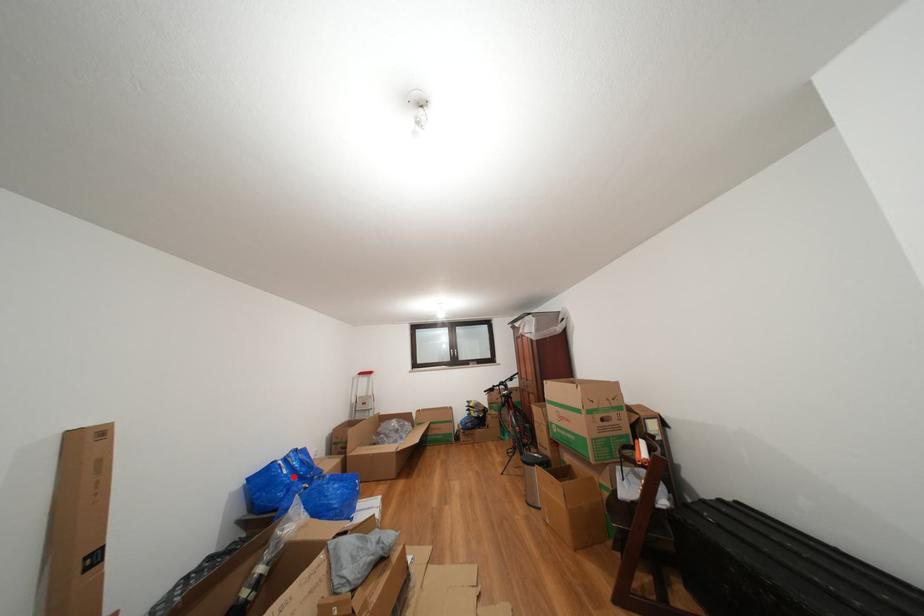
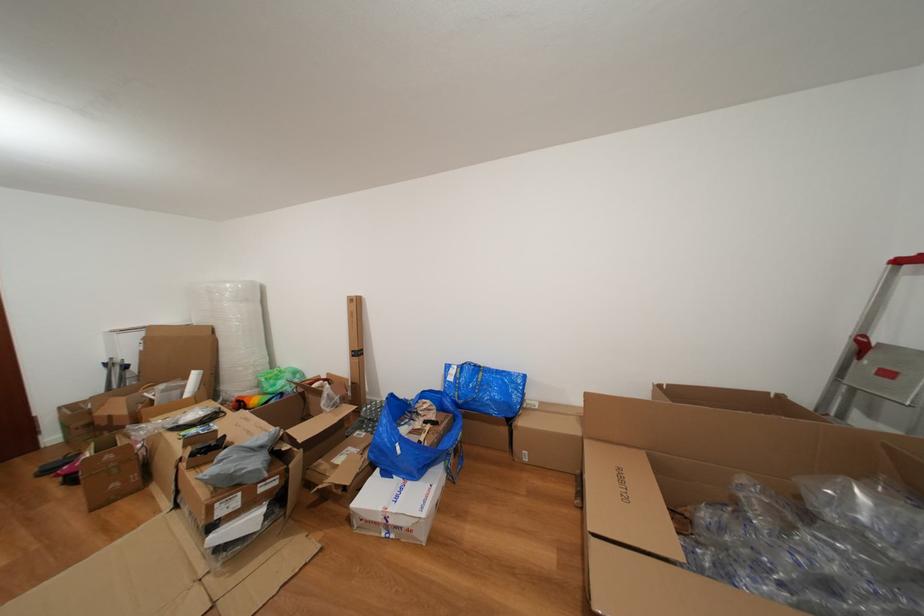
In the second image, find the point that corresponds to the highlighted location in the first image.

(458, 384)